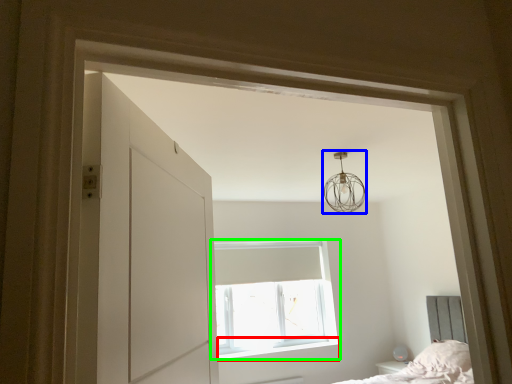
Question: Which object is positioned farthest from window sill (highlighted by a red box)? Select from lamp (highlighted by a blue box) and window (highlighted by a green box).

Choices:
 (A) lamp
 (B) window

Answer: (A)